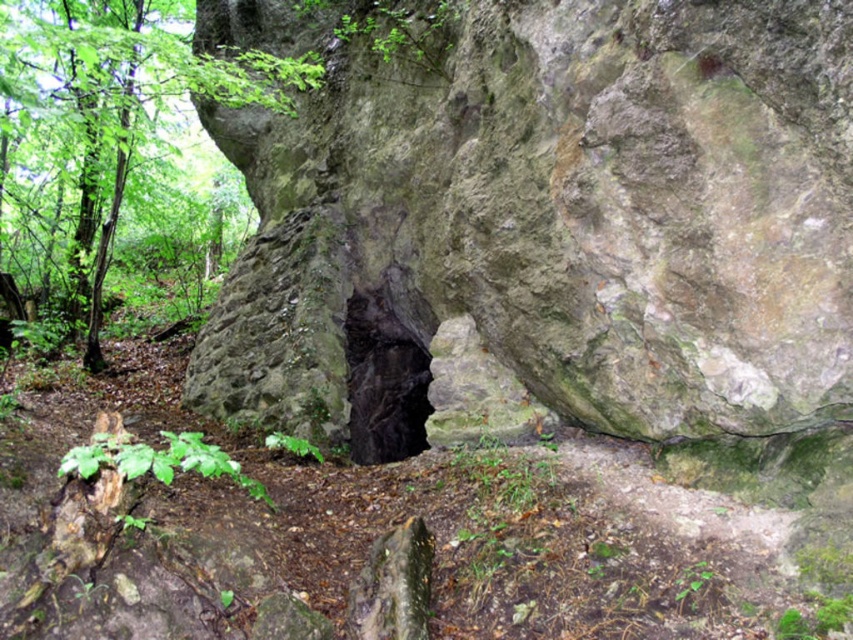
You are a hiker with a 15 foot long rope. You spot the green leafy tree at upper left and the black stone hole at center. Can you use your rope to safely cross between them?

The green leafy tree at upper left is 14.86 feet from the black stone hole at center. Since your rope is 15 feet long, it is long enough to safely cross between them.

You are a hiker trying to navigate through the forest. You see the green mossy rock at center and the green leafy tree at upper left. Which object is positioned higher up in the image?

The green leafy tree at upper left is positioned higher up in the image than the green mossy rock at center.